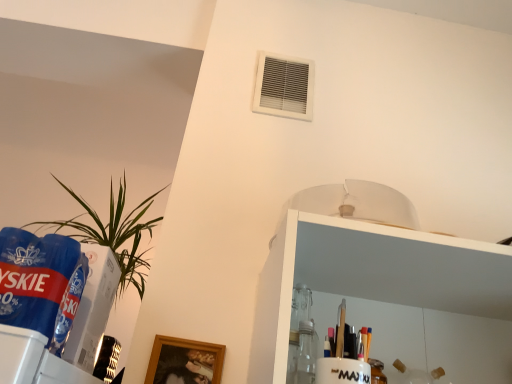
Question: Is white plastic air conditioning at upper center oriented away from blue plastic beverage at left?

Choices:
 (A) no
 (B) yes

Answer: (A)

Question: Is white plastic air conditioning at upper center further to the viewer compared to blue plastic beverage at left?

Choices:
 (A) yes
 (B) no

Answer: (A)

Question: Could you tell me if white plastic air conditioning at upper center is turned towards blue plastic beverage at left?

Choices:
 (A) yes
 (B) no

Answer: (B)

Question: Does white plastic air conditioning at upper center appear on the right side of blue plastic beverage at left?

Choices:
 (A) no
 (B) yes

Answer: (B)

Question: Is blue plastic beverage at left located within white plastic air conditioning at upper center?

Choices:
 (A) no
 (B) yes

Answer: (A)

Question: Is green leafy plant at left bigger or smaller than blue plastic beverage at left?

Choices:
 (A) big
 (B) small

Answer: (A)

Question: Considering the positions of point (135, 258) and point (7, 276), is point (135, 258) closer or farther from the camera than point (7, 276)?

Choices:
 (A) closer
 (B) farther

Answer: (B)

Question: Considering the positions of green leafy plant at left and blue plastic beverage at left in the image, is green leafy plant at left wider or thinner than blue plastic beverage at left?

Choices:
 (A) wide
 (B) thin

Answer: (A)

Question: Would you say green leafy plant at left is to the left or to the right of blue plastic beverage at left in the picture?

Choices:
 (A) right
 (B) left

Answer: (B)

Question: From the image's perspective, is blue plastic beverage at left located above or below white plastic air conditioning at upper center?

Choices:
 (A) below
 (B) above

Answer: (A)

Question: In terms of height, does blue plastic beverage at left look taller or shorter compared to white plastic air conditioning at upper center?

Choices:
 (A) short
 (B) tall

Answer: (A)

Question: Is point coord(42,244) positioned closer to the camera than point coord(294,97)?

Choices:
 (A) farther
 (B) closer

Answer: (B)

Question: Do you think blue plastic beverage at left is within white plastic air conditioning at upper center, or outside of it?

Choices:
 (A) outside
 (B) inside

Answer: (A)

Question: Considering the positions of white plastic air conditioning at upper center and green leafy plant at left in the image, is white plastic air conditioning at upper center taller or shorter than green leafy plant at left?

Choices:
 (A) tall
 (B) short

Answer: (B)

Question: From the image's perspective, is white plastic air conditioning at upper center located above or below green leafy plant at left?

Choices:
 (A) above
 (B) below

Answer: (A)